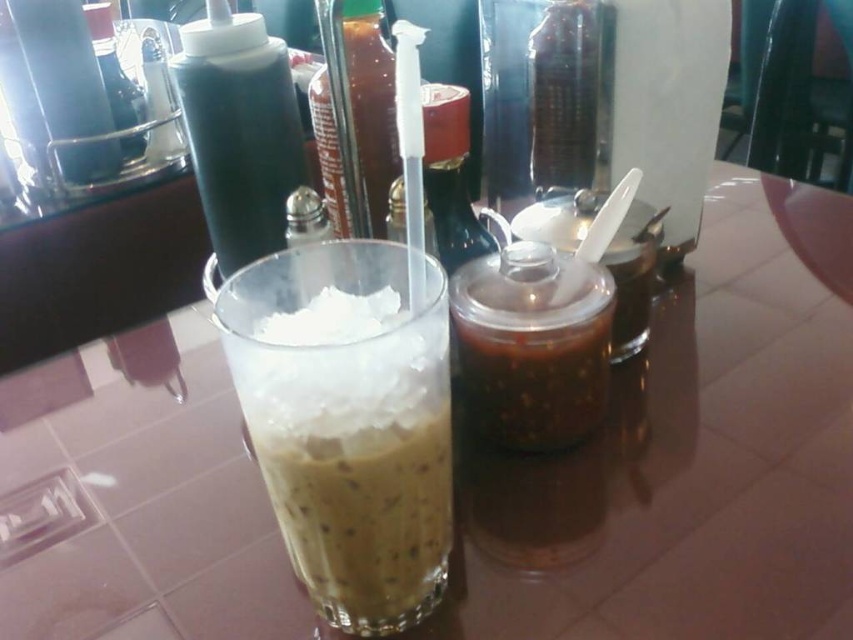
Which is more to the left, black matte bottle at upper left or transparent plastic bottle at upper left?

From the viewer's perspective, transparent plastic bottle at upper left appears more on the left side.

Is black matte bottle at upper left to the left of transparent plastic bottle at upper left from the viewer's perspective?

Incorrect, black matte bottle at upper left is not on the left side of transparent plastic bottle at upper left.

Measure the distance between point [190,99] and camera.

Point [190,99] is 14.56 inches away from camera.

You are a GUI agent. You are given a task and a screenshot of the screen. Output one action in this format:
    pyautogui.click(x=<x>, y=<y>)
    Task: Click on the black matte bottle at upper left
    The width and height of the screenshot is (853, 640).
    Given the screenshot: What is the action you would take?
    point(239,131)

Between milky white glass at center and clear plastic bottle at center, which one is positioned higher?

clear plastic bottle at center

Can you confirm if milky white glass at center is positioned below clear plastic bottle at center?

Correct, milky white glass at center is located below clear plastic bottle at center.

Where is `milky white glass at center`? This screenshot has width=853, height=640. milky white glass at center is located at coordinates (357, 467).

The image size is (853, 640). I want to click on milky white glass at center, so click(x=357, y=467).

How far apart are milky white glass at center and black matte bottle at upper left?

They are 7.32 inches apart.

Between point (422, 486) and point (190, 150), which one is positioned behind?

Point (190, 150)

You are a GUI agent. You are given a task and a screenshot of the screen. Output one action in this format:
    pyautogui.click(x=<x>, y=<y>)
    Task: Click on the milky white glass at center
    The height and width of the screenshot is (640, 853).
    Given the screenshot: What is the action you would take?
    pyautogui.click(x=357, y=467)